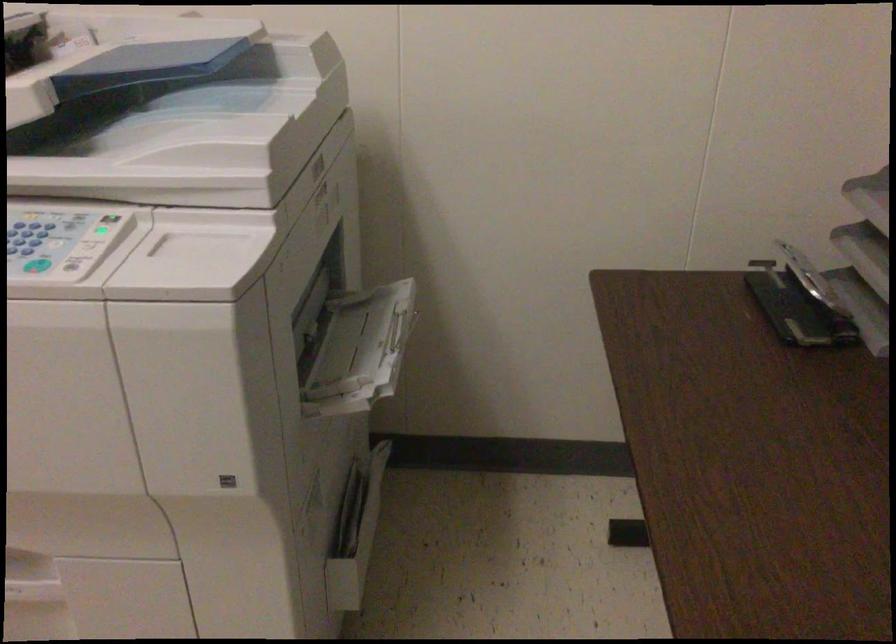
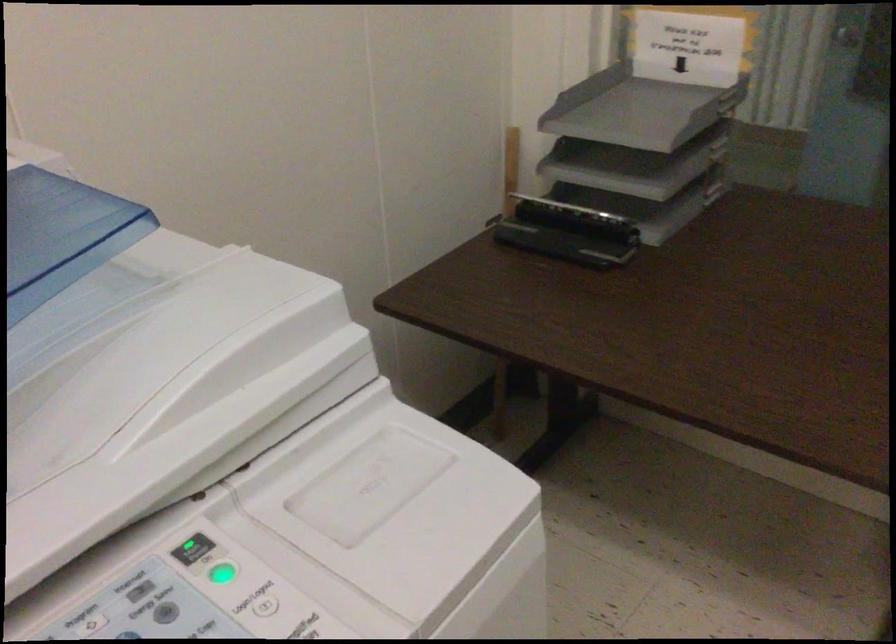
Question: The camera is either moving clockwise (left) or counter-clockwise (right) around the object. The first image is from the beginning of the video and the second image is from the end. Is the camera moving left or right when shooting the video?

Choices:
 (A) Left
 (B) Right

Answer: (A)